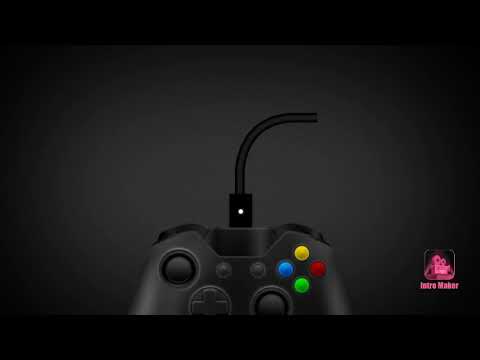
Locate an element on the screen. This screenshot has width=480, height=360. power cable is located at coordinates (240, 161).